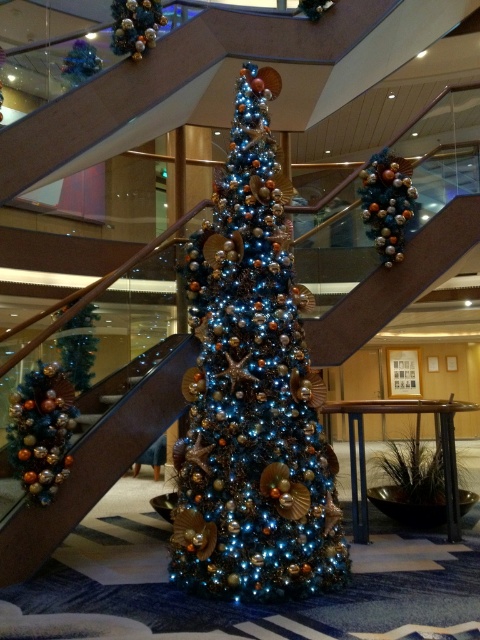
Between point (267, 234) and point (79, 388), which one is positioned in front?

Point (267, 234) is more forward.

Does iridescent metallic christmas tree at center have a greater height compared to green matte christmas tree at left?

Correct, iridescent metallic christmas tree at center is much taller as green matte christmas tree at left.

This screenshot has width=480, height=640. In order to click on iridescent metallic christmas tree at center in this screenshot , I will do `click(252, 396)`.

Looking at this image, does iridescent metallic christmas tree at center have a greater height compared to shiny metallic ornaments at upper center?

Yes.

Looking at this image, does iridescent metallic christmas tree at center appear on the left side of shiny metallic ornaments at upper center?

Yes, iridescent metallic christmas tree at center is to the left of shiny metallic ornaments at upper center.

Identify the location of iridescent metallic christmas tree at center. (252, 396).

At what (x,y) coordinates should I click in order to perform the action: click on iridescent metallic christmas tree at center. Please return your answer as a coordinate pair (x, y). Image resolution: width=480 pixels, height=640 pixels. Looking at the image, I should click on (252, 396).

Who is positioned more to the left, shiny metallic garland at left or green matte christmas tree at left?

From the viewer's perspective, shiny metallic garland at left appears more on the left side.

Between shiny metallic garland at left and green matte christmas tree at left, which one is positioned higher?

green matte christmas tree at left

Between point (48, 433) and point (74, 355), which one is positioned behind?

The point (74, 355) is behind.

This screenshot has width=480, height=640. In order to click on shiny metallic garland at left in this screenshot , I will do `click(41, 429)`.